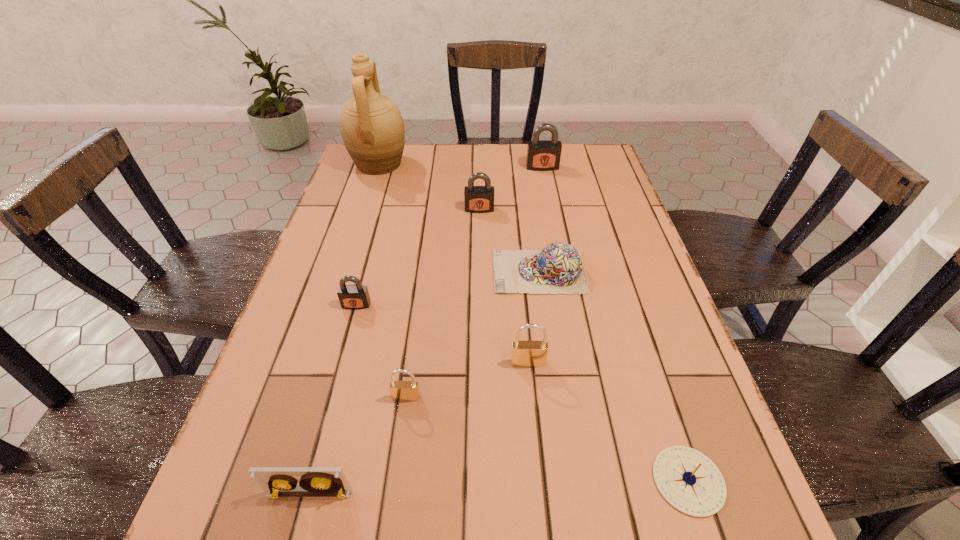
Locate an element on the screen. the left brass padlock is located at coordinates tap(400, 390).

This screenshot has height=540, width=960. I want to click on videotape, so click(x=276, y=481).

Identify the location of the sixth nearest object. The height and width of the screenshot is (540, 960). (558, 268).

This screenshot has width=960, height=540. What are the coordinates of `the eighth tallest object` in the screenshot? It's located at (558, 268).

The width and height of the screenshot is (960, 540). I want to click on blue compass, so click(x=688, y=480).

Image resolution: width=960 pixels, height=540 pixels. I want to click on compass, so click(x=688, y=480).

At what (x,y) coordinates should I click in order to perform the action: click on vacant space located 0.210m on the front of the tallest object. Please return your answer as a coordinate pair (x, y). Looking at the image, I should click on (360, 221).

Locate an element on the screen. This screenshot has height=540, width=960. vacant space positioned on the front of the farthest padlock near the keyhole is located at coordinates (545, 183).

Where is `vacant area situated 0.080m on the front of the second farthest gray padlock near the keyhole`? Image resolution: width=960 pixels, height=540 pixels. vacant area situated 0.080m on the front of the second farthest gray padlock near the keyhole is located at coordinates (479, 231).

Where is `free space located on the front-facing side of the sixth farthest object`? free space located on the front-facing side of the sixth farthest object is located at coordinates (543, 525).